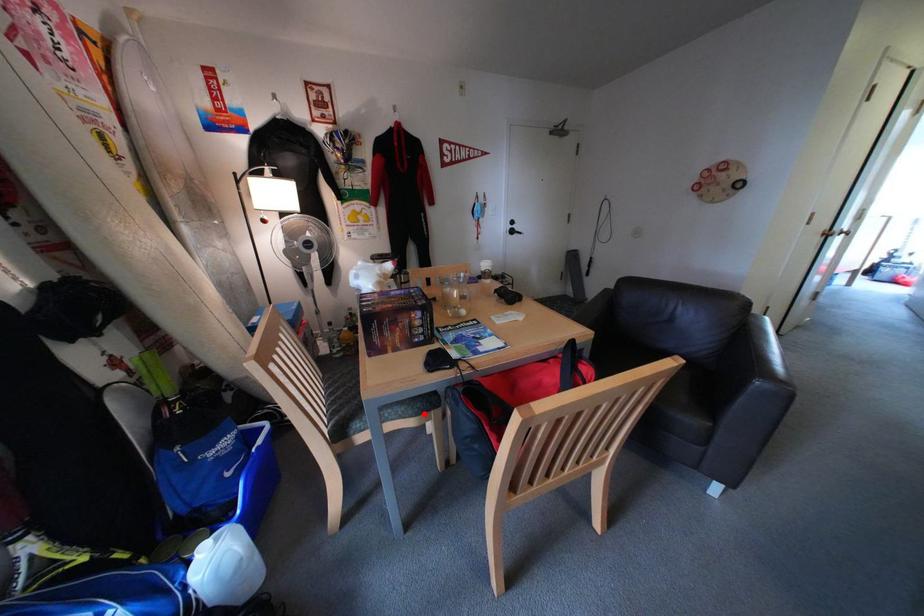
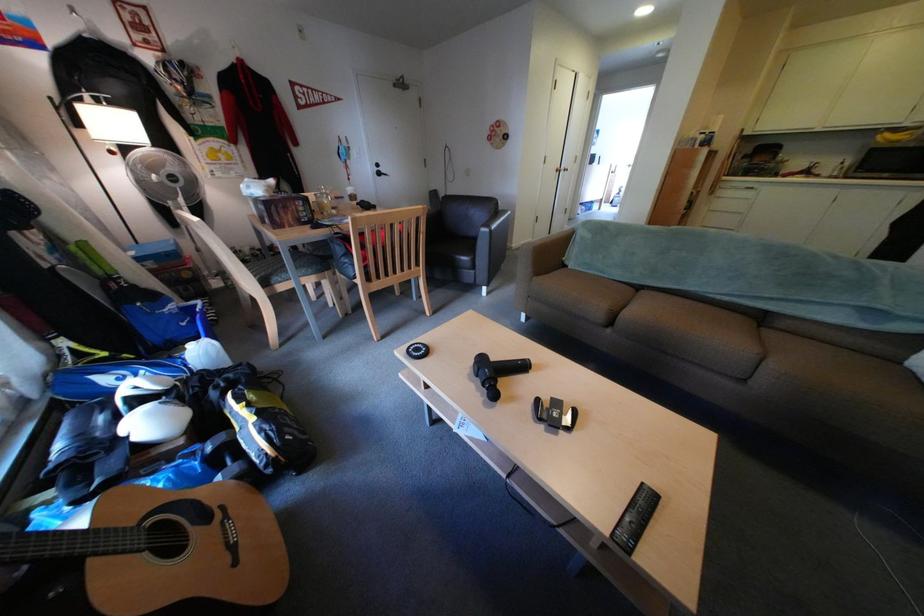
In the second image, find the point that corresponds to the highlighted location in the first image.

(324, 272)